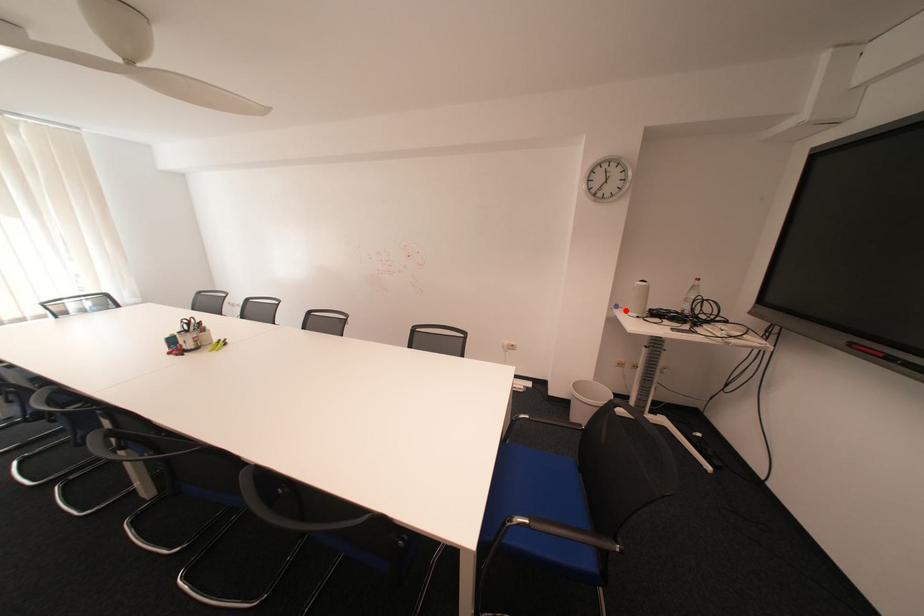
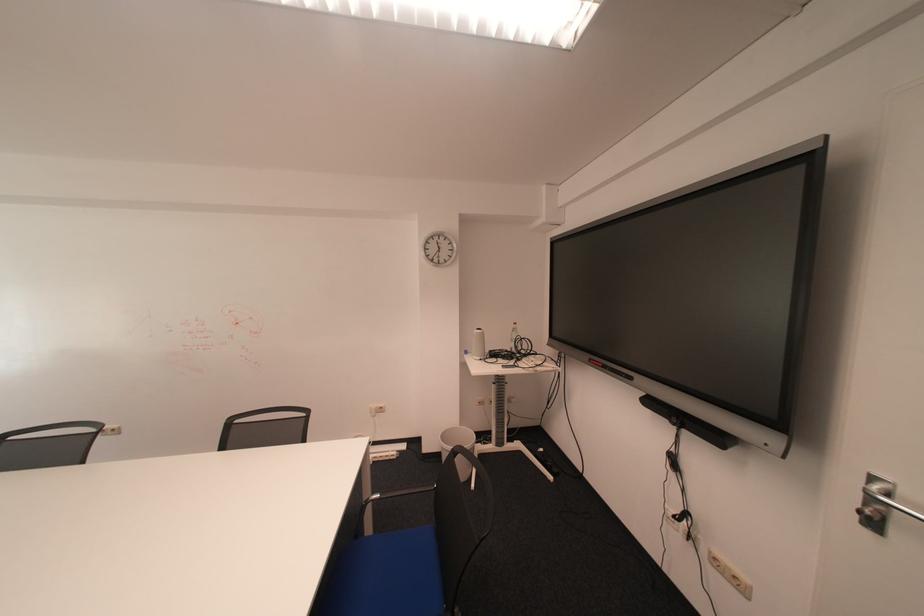
Where in the second image is the point corresponding to the highlighted location from the first image?

(477, 355)